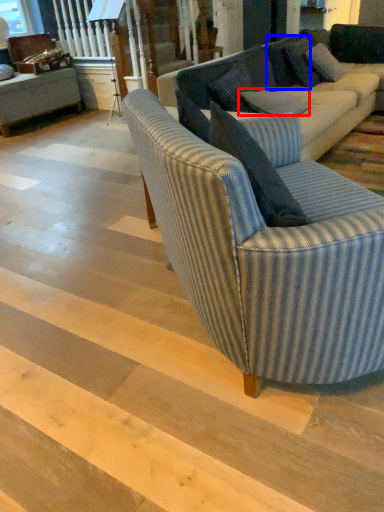
Question: Which object appears closest to the camera in this image, pillow (highlighted by a red box) or pillow (highlighted by a blue box)?

Choices:
 (A) pillow
 (B) pillow

Answer: (A)